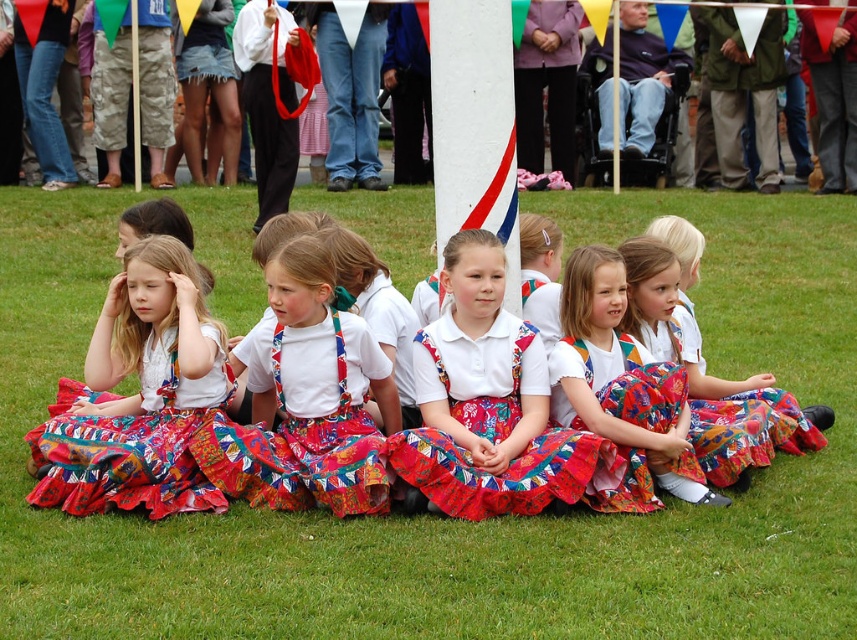
Based on the scene description, where is the green grass at center located in relation to the multicolored fabric dress at center?

The green grass at center is to the left of the multicolored fabric dress at center.

You are a photographer trying to capture a closeup of the floral cotton dress at center and the multicolored fabric dress at center. Since you want to focus on both dresses equally, which dress should you move closer to the camera to make them appear the same size in the photo?

The floral cotton dress at center is bigger than the multicolored fabric dress at center, so you should move the multicolored fabric dress at center closer to the camera to balance their sizes in the photo.

You are a photographer trying to capture a photo of the green grass at center and the floral cotton dress at center. If your camera has a depth of field that can focus on objects within 5 feet, will both subjects be in focus?

The distance between the green grass at center and the floral cotton dress at center is 5.93 feet, which exceeds the camera depth of field of 5 feet. Therefore, both subjects cannot be in focus simultaneously.